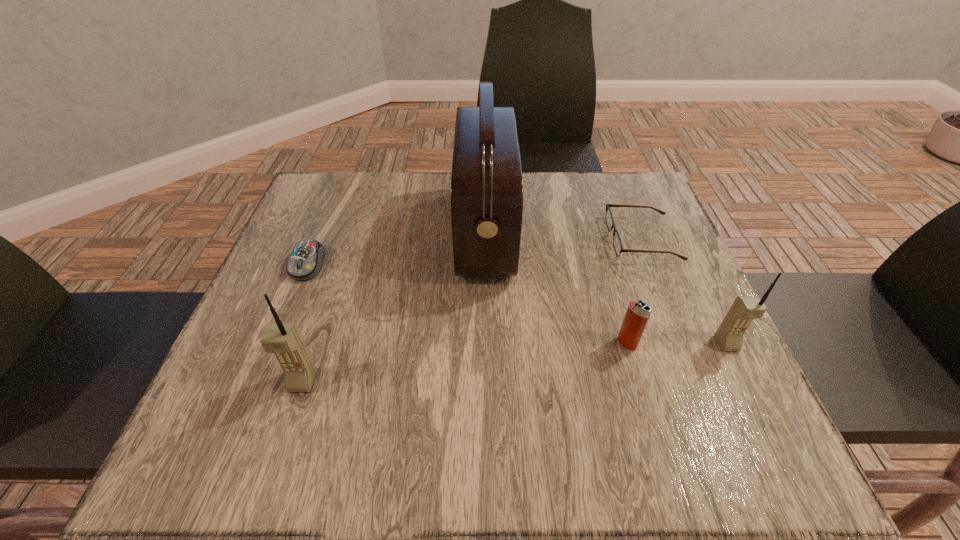
The width and height of the screenshot is (960, 540). Identify the location of the left cellular telephone. (284, 340).

Locate an element on the screen. Image resolution: width=960 pixels, height=540 pixels. the taller cellular telephone is located at coordinates (284, 340).

Identify the location of the right cellular telephone. Image resolution: width=960 pixels, height=540 pixels. (729, 335).

At what (x,y) coordinates should I click in order to perform the action: click on the third tallest object. Please return your answer as a coordinate pair (x, y). The height and width of the screenshot is (540, 960). Looking at the image, I should click on (729, 335).

In order to click on the third object from left to right in this screenshot , I will do `click(486, 180)`.

Where is `the tallest object`? the tallest object is located at coordinates (486, 180).

Where is `spectacles`? spectacles is located at coordinates (617, 242).

The image size is (960, 540). I want to click on the leftmost object, so [305, 262].

Identify the location of the third object from right to left. The height and width of the screenshot is (540, 960). (637, 314).

At what (x,y) coordinates should I click in order to perform the action: click on the third shortest object. Please return your answer as a coordinate pair (x, y). Looking at the image, I should click on (637, 314).